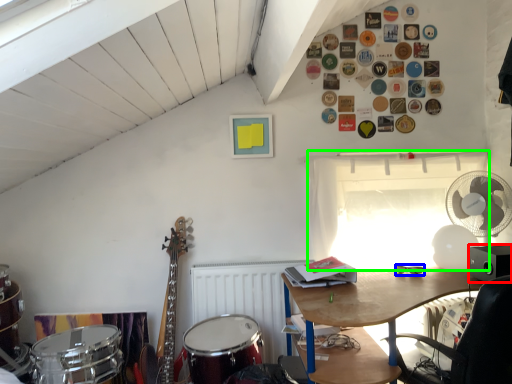
Question: Considering the real-world distances, which object is closest to loudspeaker (highlighted by a red box)? glasses (highlighted by a blue box) or window (highlighted by a green box).

Choices:
 (A) glasses
 (B) window

Answer: (A)